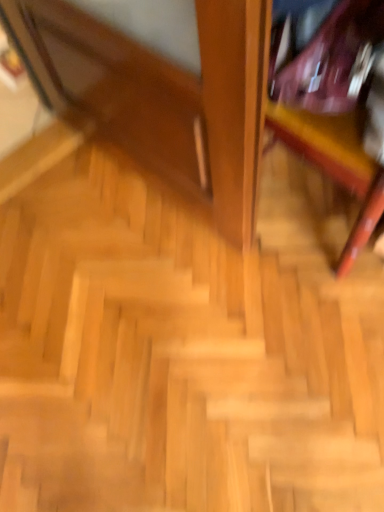
Question: Is wooden stairs at center with wooden bookshelf at upper right?

Choices:
 (A) yes
 (B) no

Answer: (B)

Question: From the image's perspective, does wooden stairs at center appear higher than wooden bookshelf at upper right?

Choices:
 (A) no
 (B) yes

Answer: (A)

Question: Is wooden stairs at center facing towards wooden bookshelf at upper right?

Choices:
 (A) no
 (B) yes

Answer: (A)

Question: From a real-world perspective, is wooden stairs at center located beneath wooden bookshelf at upper right?

Choices:
 (A) no
 (B) yes

Answer: (B)

Question: Is wooden stairs at center shorter than wooden bookshelf at upper right?

Choices:
 (A) yes
 (B) no

Answer: (A)

Question: Is the depth of wooden stairs at center greater than that of wooden bookshelf at upper right?

Choices:
 (A) yes
 (B) no

Answer: (A)

Question: Is wooden bookshelf at upper right further to the viewer compared to wooden stairs at center?

Choices:
 (A) yes
 (B) no

Answer: (B)

Question: Could you tell me if wooden bookshelf at upper right is turned towards wooden stairs at center?

Choices:
 (A) yes
 (B) no

Answer: (A)

Question: Can you confirm if wooden bookshelf at upper right is smaller than wooden stairs at center?

Choices:
 (A) no
 (B) yes

Answer: (A)

Question: Is wooden bookshelf at upper right bigger than wooden stairs at center?

Choices:
 (A) no
 (B) yes

Answer: (B)

Question: Is the position of wooden bookshelf at upper right less distant than that of wooden stairs at center?

Choices:
 (A) no
 (B) yes

Answer: (B)

Question: From the image's perspective, is wooden bookshelf at upper right on wooden stairs at center?

Choices:
 (A) no
 (B) yes

Answer: (B)

Question: From a real-world perspective, is wooden stairs at center physically located above or below wooden bookshelf at upper right?

Choices:
 (A) below
 (B) above

Answer: (A)